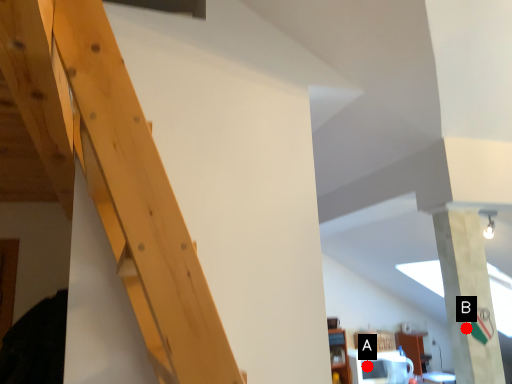
Question: Two points are circled on the image, labeled by A and B beside each circle. Which point is closer to the camera?

Choices:
 (A) A is closer
 (B) B is closer

Answer: (B)